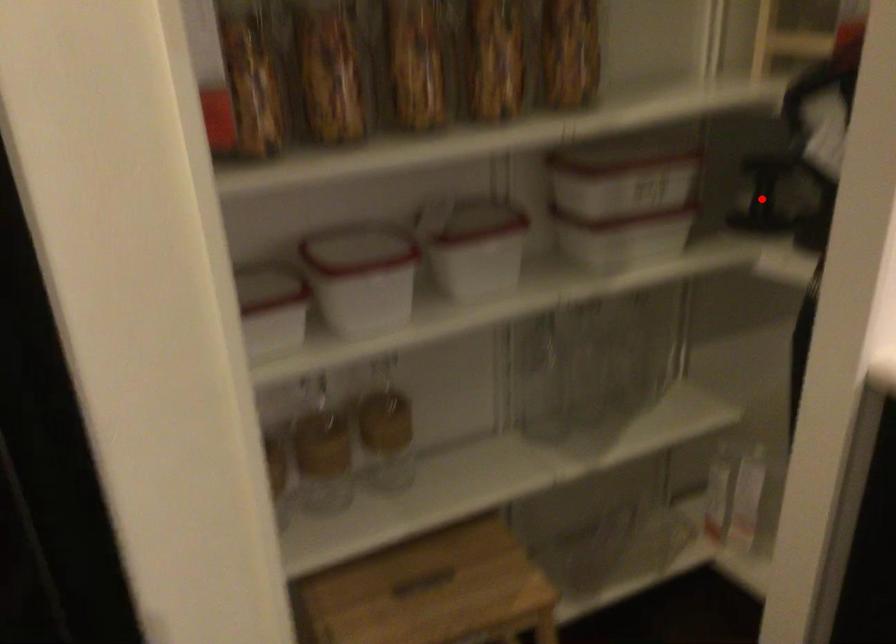
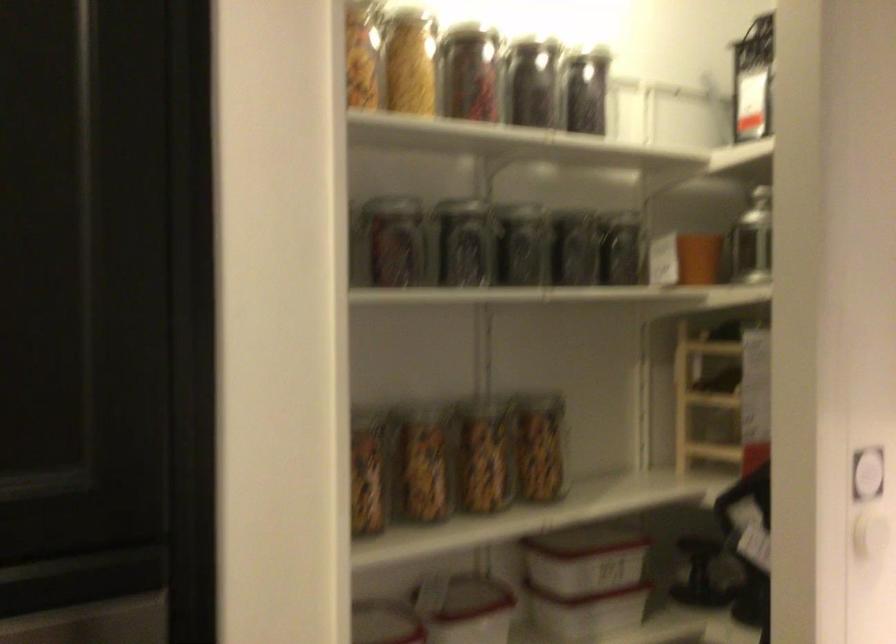
Where in the second image is the point corresponding to the highlighted location from the first image?

(700, 574)